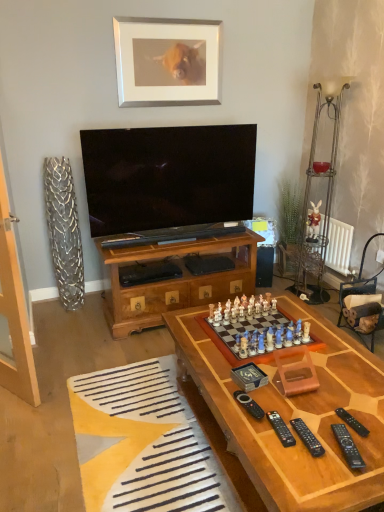
This screenshot has height=512, width=384. In order to click on free space between black plastic remote at lower right, the fourth remote when ordered from left to right, and black plastic remote at lower right, which is the 2th remote from left to right in this screenshot , I will do `click(313, 441)`.